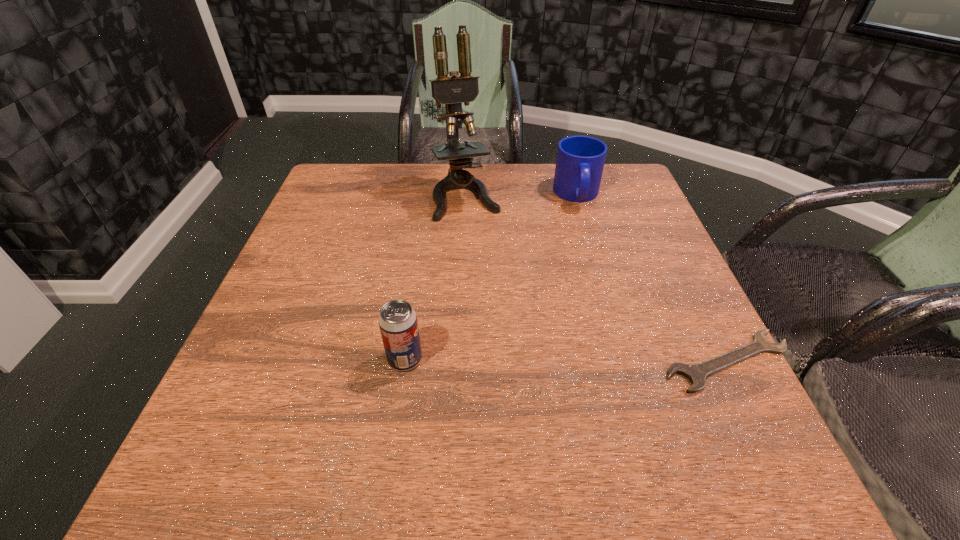
Where is `vacant region at the far edge`? The image size is (960, 540). vacant region at the far edge is located at coordinates (546, 196).

Identify the location of vacant space at the near edge of the desktop. (527, 393).

Where is `vacant space at the left edge of the desktop`? Image resolution: width=960 pixels, height=540 pixels. vacant space at the left edge of the desktop is located at coordinates (251, 344).

Locate an element on the screen. vacant space at the right edge is located at coordinates (626, 212).

Find the location of a particular element. The height and width of the screenshot is (540, 960). vacant space at the far left corner is located at coordinates (319, 207).

Where is `free location at the near left corner`? free location at the near left corner is located at coordinates (264, 423).

Identify the location of vacant area at the far right corner. (599, 191).

The height and width of the screenshot is (540, 960). Identify the location of free space that is in between the tallest object and the second object from right to left. (521, 196).

The image size is (960, 540). I want to click on unoccupied area between the mug and the tallest object, so click(521, 196).

Locate an element on the screen. The width and height of the screenshot is (960, 540). free space between the beer can and the rightmost object is located at coordinates (566, 360).